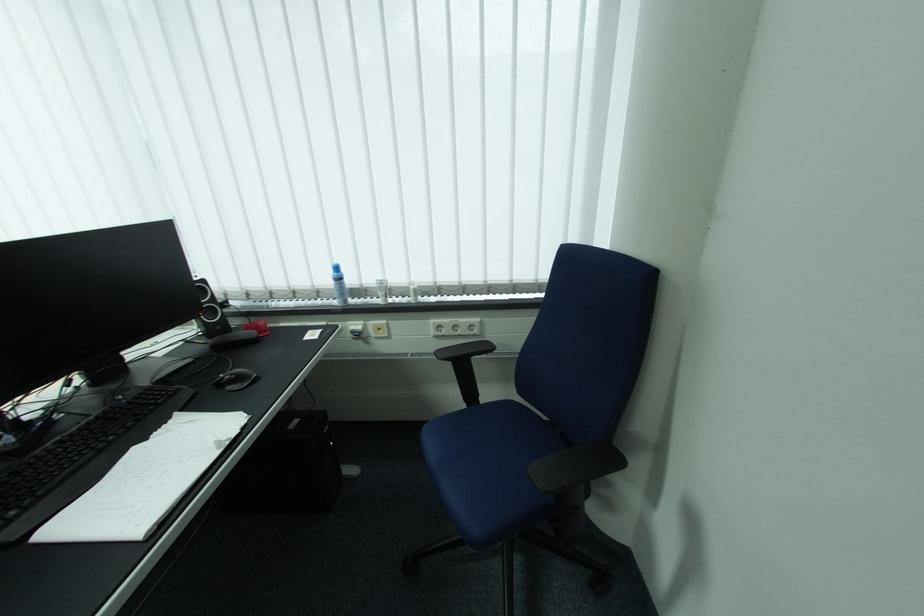
Locate an element on the screen. The image size is (924, 616). white cosmetic tube is located at coordinates (382, 291).